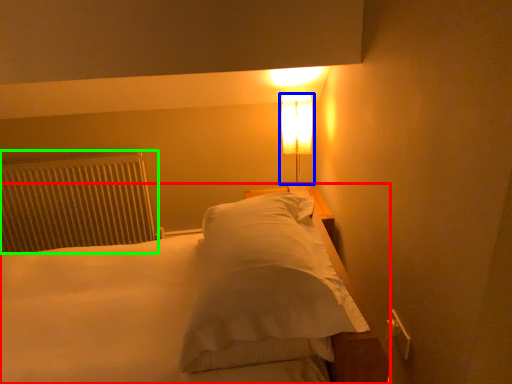
Question: Estimate the real-world distances between objects in this image. Which object is farther from bed (highlighted by a red box), lamp (highlighted by a blue box) or radiator (highlighted by a green box)?

Choices:
 (A) lamp
 (B) radiator

Answer: (A)